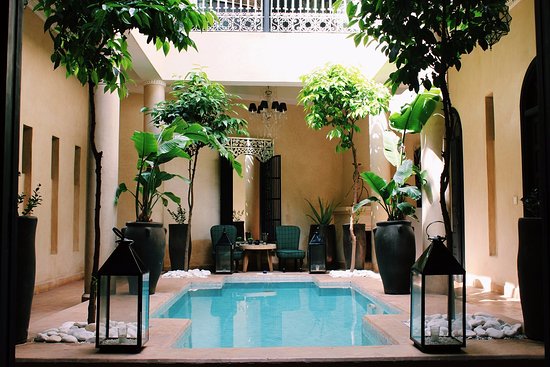
Where is `left lantern`? The width and height of the screenshot is (550, 367). left lantern is located at coordinates (118, 258).